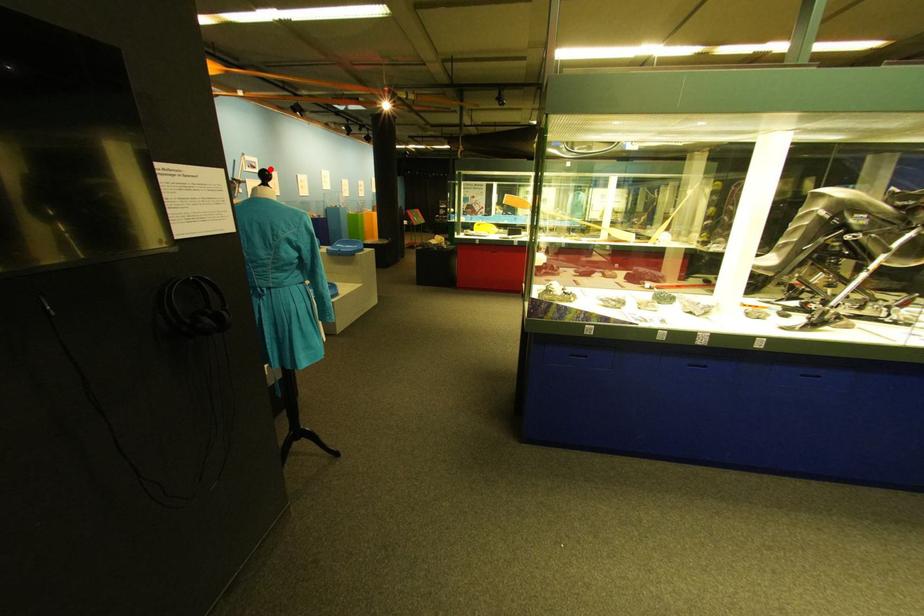
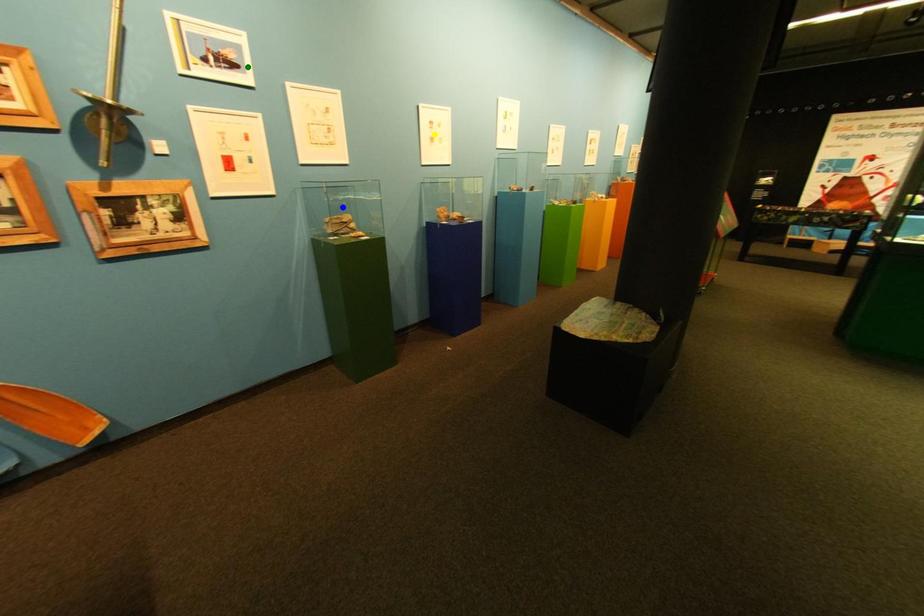
Question: I am providing you with two images of the same scene from different viewpoints. A red point is marked on the first image. You are given multiple points on the second image. Which point in image 2 is actually the same real-world point as the red point in image 1?

Choices:
 (A) blue point
 (B) green point
 (C) yellow point

Answer: (B)